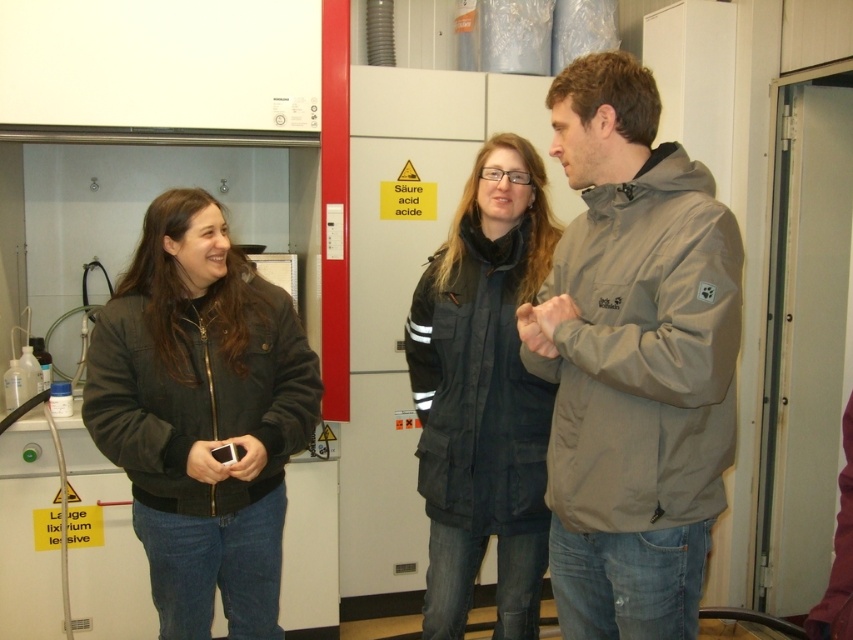
Question: Among these points, which one is nearest to the camera?

Choices:
 (A) (596, 296)
 (B) (527, 202)
 (C) (230, 554)

Answer: (A)

Question: Observing the image, what is the correct spatial positioning of gray matte jacket at center in reference to black puffy jacket at center?

Choices:
 (A) below
 (B) above

Answer: (B)

Question: Can you confirm if gray matte jacket at center is positioned above matte black jacket at left?

Choices:
 (A) no
 (B) yes

Answer: (B)

Question: Which object is the farthest from the black puffy jacket at center?

Choices:
 (A) matte black jacket at left
 (B) gray matte jacket at center

Answer: (A)

Question: Among these objects, which one is nearest to the camera?

Choices:
 (A) gray matte jacket at center
 (B) black puffy jacket at center
 (C) matte black jacket at left

Answer: (A)

Question: Can you confirm if matte black jacket at left is positioned below black puffy jacket at center?

Choices:
 (A) yes
 (B) no

Answer: (A)